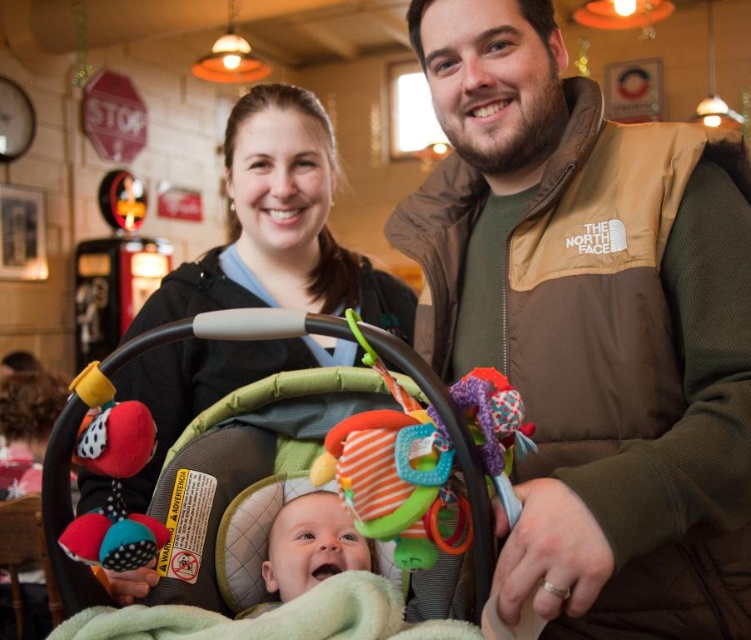
You are a photographer trying to capture a closeup of the point marked at coordinates (68,563) in the image. The camera you are using has a minimum focusing distance of 36 inches. Will you be able to take a clear photo of the point without moving the camera closer?

The point at coordinates (68,563) is 35.98 inches away from the camera. Since the minimum focusing distance is 36 inches, the camera cannot focus on objects closer than that. Therefore, you won t be able to take a clear photo without moving the camera closer.

You are a parent trying to ensure your baby stays warm in the store. The baby is in the green fabric baby carriage at center and wearing the soft green blanket at center. Which item is positioned higher to potentially block the blanket from slipping down?

The green fabric baby carriage at center is located above the soft green blanket at center, so it could help block the blanket from slipping down.